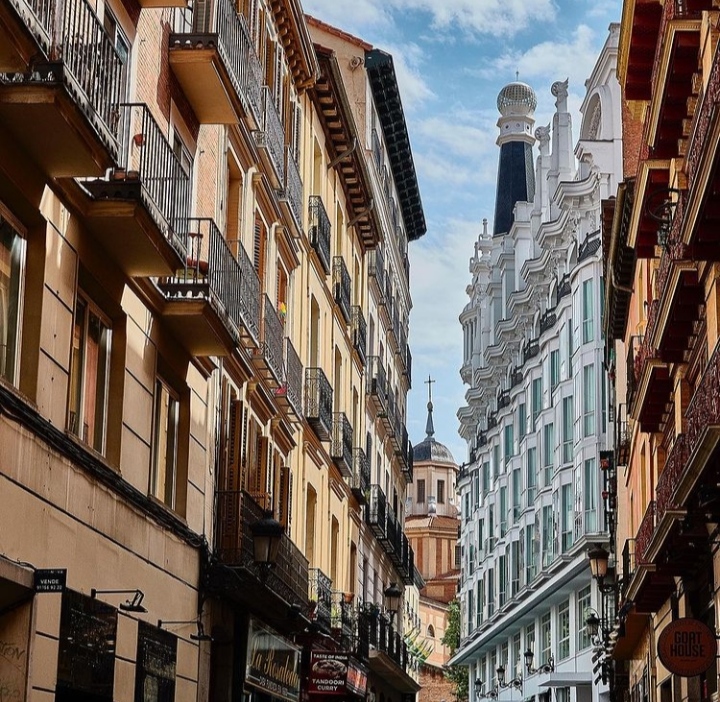
Where is `lantern`? Image resolution: width=720 pixels, height=702 pixels. lantern is located at coordinates (474, 682), (500, 675), (526, 656), (595, 620), (597, 557), (266, 540), (396, 594).